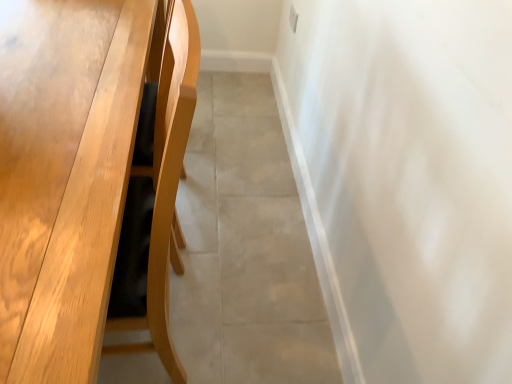
Question: Does beige tile floor at center appear on the right side of light brown wood table at left?

Choices:
 (A) no
 (B) yes

Answer: (B)

Question: Is beige tile floor at center outside light brown wood table at left?

Choices:
 (A) yes
 (B) no

Answer: (A)

Question: Is beige tile floor at center positioned before light brown wood table at left?

Choices:
 (A) yes
 (B) no

Answer: (B)

Question: Is beige tile floor at center with light brown wood table at left?

Choices:
 (A) no
 (B) yes

Answer: (A)

Question: Is beige tile floor at center far away from light brown wood table at left?

Choices:
 (A) no
 (B) yes

Answer: (A)

Question: Is beige tile floor at center facing away from light brown wood table at left?

Choices:
 (A) no
 (B) yes

Answer: (A)

Question: Is light brown wood table at left aimed at beige tile floor at center?

Choices:
 (A) yes
 (B) no

Answer: (B)

Question: Is light brown wood table at left thinner than beige tile floor at center?

Choices:
 (A) no
 (B) yes

Answer: (A)

Question: From a real-world perspective, does light brown wood table at left sit lower than beige tile floor at center?

Choices:
 (A) yes
 (B) no

Answer: (B)

Question: Is light brown wood table at left wider than beige tile floor at center?

Choices:
 (A) yes
 (B) no

Answer: (A)

Question: Is beige tile floor at center a part of light brown wood table at left?

Choices:
 (A) yes
 (B) no

Answer: (B)

Question: Is light brown wood table at left far from beige tile floor at center?

Choices:
 (A) no
 (B) yes

Answer: (A)

Question: Considering the positions of point (17, 178) and point (248, 200), is point (17, 178) closer or farther from the camera than point (248, 200)?

Choices:
 (A) farther
 (B) closer

Answer: (B)